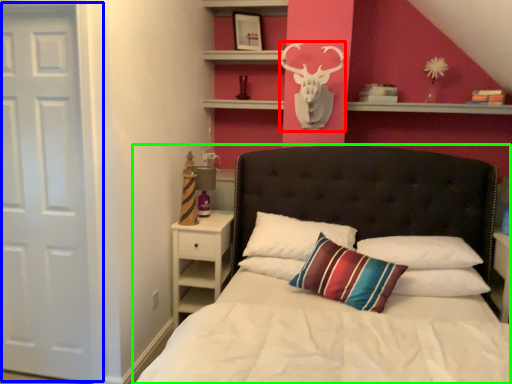
Question: Which object is positioned closest to deer (highlighted by a red box)? Select from door (highlighted by a blue box) and bed (highlighted by a green box).

Choices:
 (A) door
 (B) bed

Answer: (B)